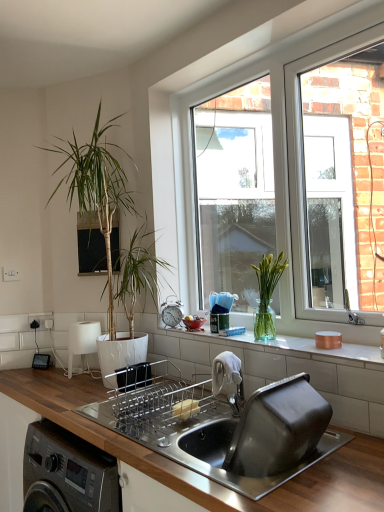
Question: Is green glass vase at window, the 2th houseplant when ordered from back to front, not inside green leafy plant at left, which is counted as the first houseplant, starting from the back?

Choices:
 (A) no
 (B) yes

Answer: (B)

Question: Is green glass vase at window, the 2th houseplant when ordered from back to front, at the right side of green leafy plant at left, arranged as the 1th houseplant when viewed from the left?

Choices:
 (A) yes
 (B) no

Answer: (A)

Question: Is the depth of green glass vase at window, the 2th houseplant when ordered from back to front, less than that of green leafy plant at left, arranged as the 1th houseplant when viewed from the left?

Choices:
 (A) no
 (B) yes

Answer: (B)

Question: Is green glass vase at window, which ranks as the 1th houseplant in right-to-left order, beside green leafy plant at left, the second houseplant when ordered from front to back?

Choices:
 (A) no
 (B) yes

Answer: (A)

Question: Is green leafy plant at left, the 2th houseplant in the right-to-left sequence, a part of green glass vase at window, the first houseplant in the front-to-back sequence?

Choices:
 (A) yes
 (B) no

Answer: (B)

Question: From a real-world perspective, is green glass vase at window, the 2th houseplant when ordered from back to front, located higher than green leafy plant at left, the second houseplant when ordered from front to back?

Choices:
 (A) no
 (B) yes

Answer: (A)

Question: Is green leafy plant at left, which is counted as the first houseplant, starting from the back, located outside green glass vase at window, the first houseplant in the front-to-back sequence?

Choices:
 (A) yes
 (B) no

Answer: (A)

Question: Would you say green leafy plant at left, arranged as the 1th houseplant when viewed from the left, is a long distance from green glass vase at window, which ranks as the 1th houseplant in right-to-left order?

Choices:
 (A) yes
 (B) no

Answer: (B)

Question: From the image's perspective, would you say green leafy plant at left, which is counted as the first houseplant, starting from the back, is shown under green glass vase at window, which ranks as the 1th houseplant in right-to-left order?

Choices:
 (A) no
 (B) yes

Answer: (A)

Question: Is green leafy plant at left, the 2th houseplant in the right-to-left sequence, further to camera compared to green glass vase at window, the 2th houseplant when ordered from back to front?

Choices:
 (A) no
 (B) yes

Answer: (B)

Question: Can you confirm if green leafy plant at left, the second houseplant when ordered from front to back, is thinner than green glass vase at window, placed as the second houseplant when sorted from left to right?

Choices:
 (A) no
 (B) yes

Answer: (A)

Question: Considering the relative sizes of green leafy plant at left, the second houseplant when ordered from front to back, and green glass vase at window, which ranks as the 1th houseplant in right-to-left order, in the image provided, is green leafy plant at left, the second houseplant when ordered from front to back, smaller than green glass vase at window, which ranks as the 1th houseplant in right-to-left order,?

Choices:
 (A) no
 (B) yes

Answer: (A)

Question: From the image's perspective, would you say clear glass vase at center is positioned over green glass vase at window, which ranks as the 1th houseplant in right-to-left order?

Choices:
 (A) no
 (B) yes

Answer: (A)